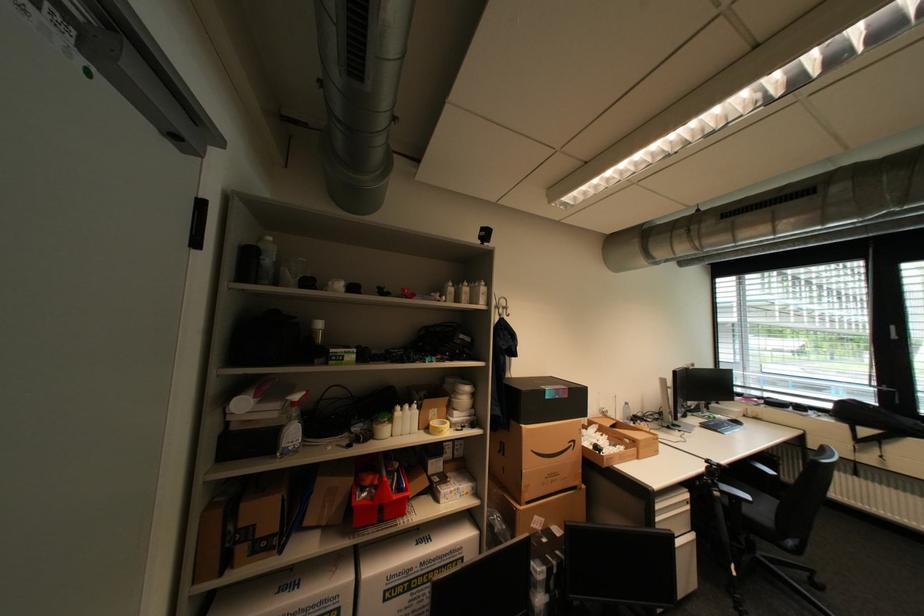
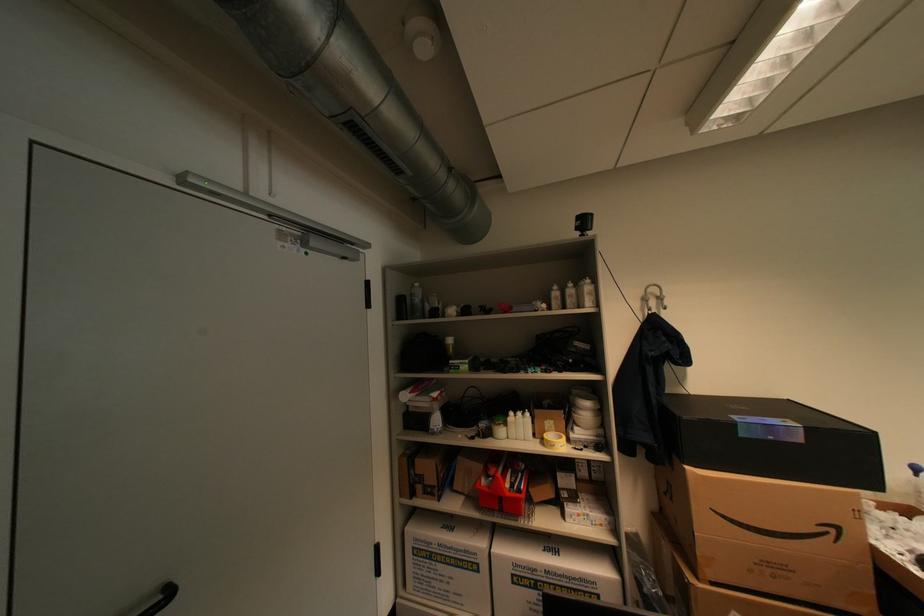
In the second image, find the point that corresponds to pixel 407 408 in the first image.

(519, 414)